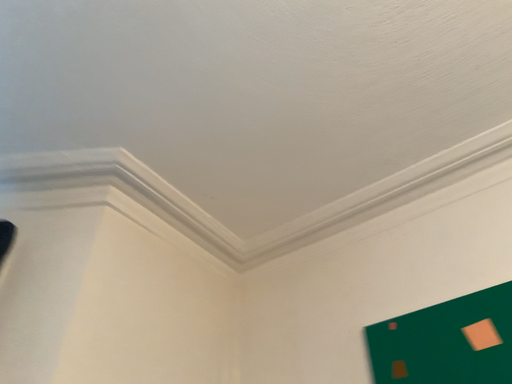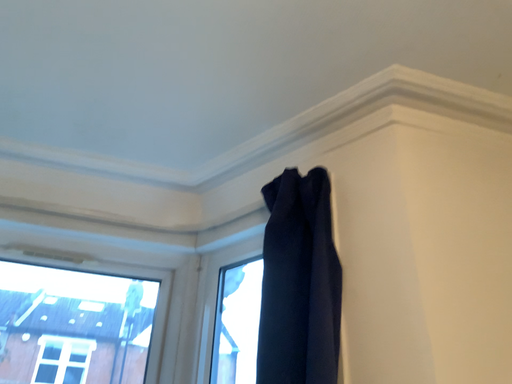
Question: Which way did the camera rotate in the video?

Choices:
 (A) rotated left
 (B) rotated right

Answer: (A)